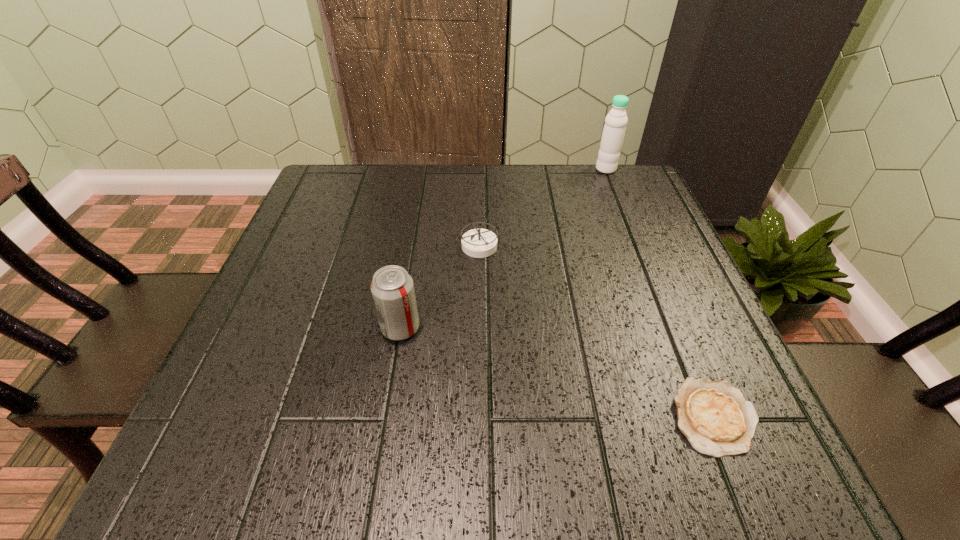
Find the location of a particular element. vacant space in between the compass and the second tallest object is located at coordinates (440, 287).

The height and width of the screenshot is (540, 960). Identify the location of vacant area that lies between the leftmost object and the nearest object. (557, 372).

What are the coordinates of `free point between the farthest object and the third shortest object` in the screenshot? It's located at (503, 248).

Find the location of a particular element. empty space between the soda can and the second object from left to right is located at coordinates (440, 287).

Where is `object identified as the third closest to the quiche`? Image resolution: width=960 pixels, height=540 pixels. object identified as the third closest to the quiche is located at coordinates (616, 120).

Point out which object is positioned as the second nearest to the nearest object. Please provide its 2D coordinates. Your answer should be formatted as a tuple, i.e. [(x, y)], where the tuple contains the x and y coordinates of a point satisfying the conditions above.

[(392, 288)]

Image resolution: width=960 pixels, height=540 pixels. In order to click on vacant space that satisfies the following two spatial constraints: 1. on the front side of the second farthest object; 2. on the left side of the nearest object in this screenshot , I will do `click(479, 416)`.